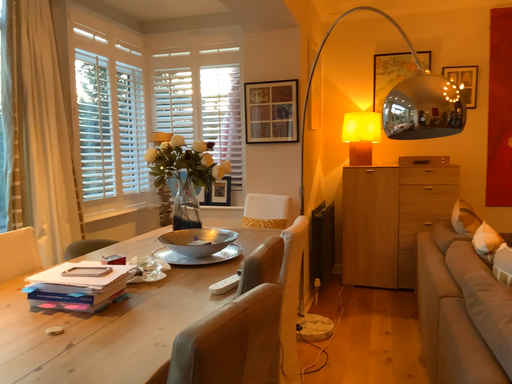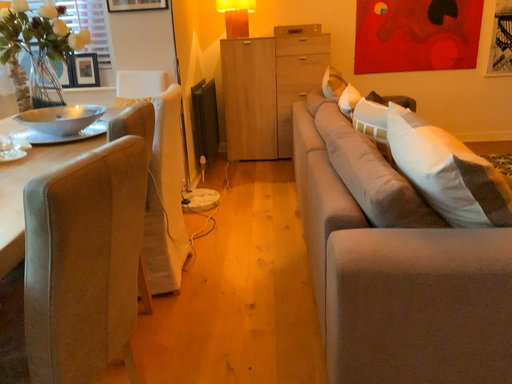
Question: How did the camera likely rotate when shooting the video?

Choices:
 (A) rotated downward
 (B) rotated upward

Answer: (A)